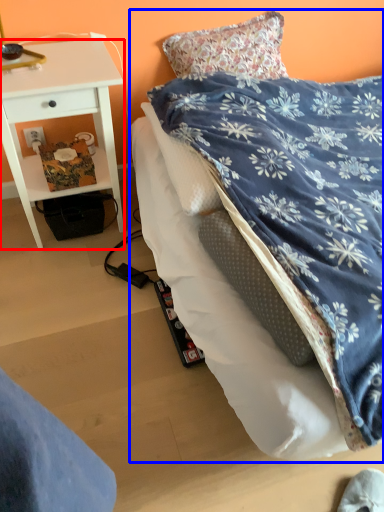
Question: Which object is closer to the camera taking this photo, desk (highlighted by a red box) or bed (highlighted by a blue box)?

Choices:
 (A) desk
 (B) bed

Answer: (B)